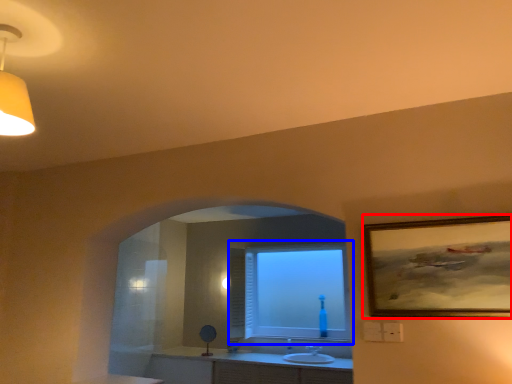
Question: Which object is further to the camera taking this photo, picture frame (highlighted by a red box) or window (highlighted by a blue box)?

Choices:
 (A) picture frame
 (B) window

Answer: (B)